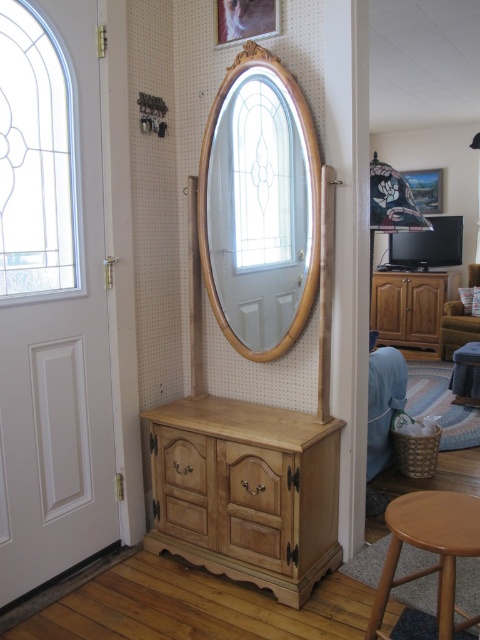
Who is higher up, matte wooden picture frame at upper center or wooden picture frame at upper right?

Positioned higher is wooden picture frame at upper right.

Is point (224, 10) positioned before point (419, 172)?

Yes.

At what (x,y) coordinates should I click in order to perform the action: click on matte wooden picture frame at upper center. Please return your answer as a coordinate pair (x, y). This screenshot has height=640, width=480. Looking at the image, I should click on (245, 19).

Who is shorter, light brown wooden dresser at right or matte wooden picture frame at upper center?

matte wooden picture frame at upper center

I want to click on light brown wooden dresser at right, so click(x=410, y=307).

This screenshot has height=640, width=480. Find the location of `light brown wooden dresser at right`. light brown wooden dresser at right is located at coordinates (410, 307).

Can you confirm if wooden stool at lower right is bigger than wooden picture frame at upper right?

Correct, wooden stool at lower right is larger in size than wooden picture frame at upper right.

Who is lower down, wooden stool at lower right or wooden picture frame at upper right?

wooden stool at lower right is lower down.

What do you see at coordinates (466, 374) in the screenshot? I see `wooden stool at lower right` at bounding box center [466, 374].

This screenshot has height=640, width=480. I want to click on wooden stool at lower right, so click(466, 374).